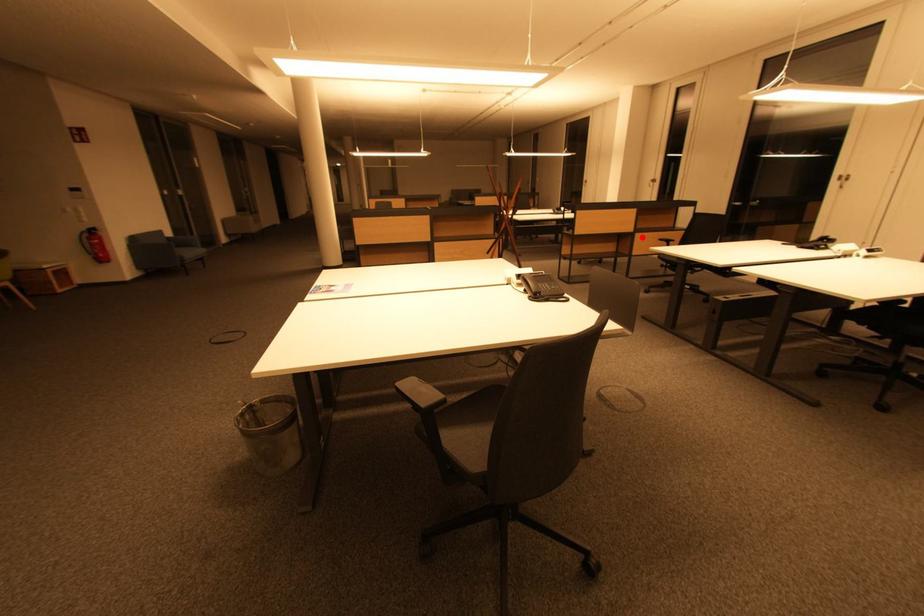
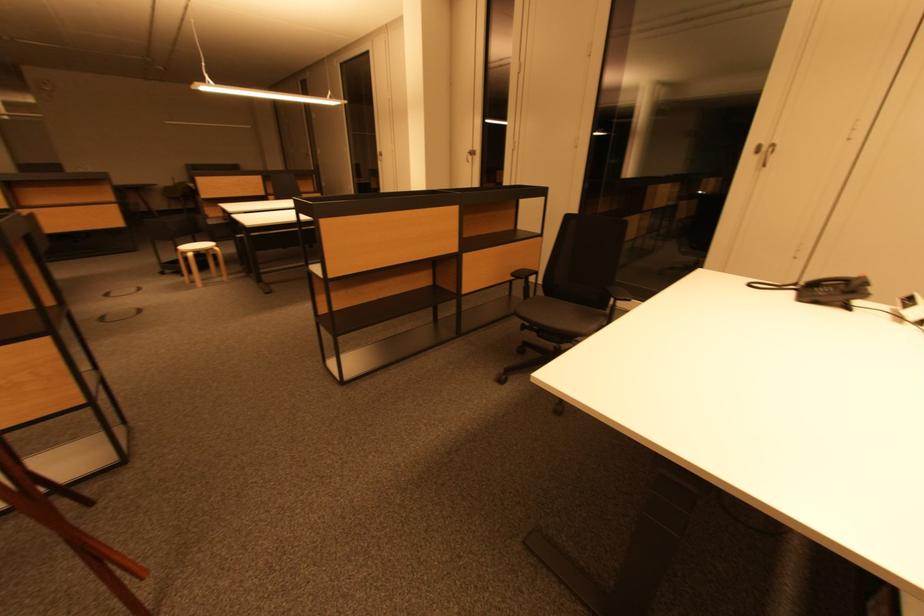
Question: I am providing you with two images of the same scene from different viewpoints. Given a red point in image1, look at the same physical point in image2. Is it:

Choices:
 (A) Closer to the viewpoint
 (B) Farther from the viewpoint

Answer: (B)